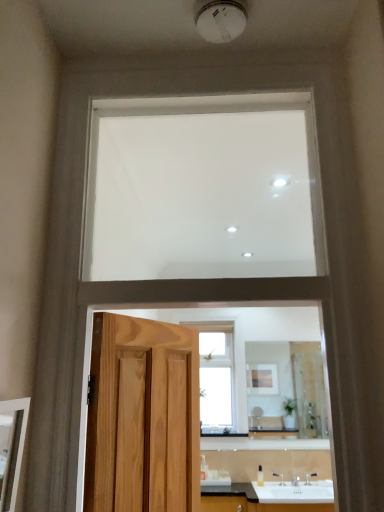
Question: Can you confirm if clear glass window at center, acting as the second window starting from the front, is thinner than white glossy sink at lower center?

Choices:
 (A) no
 (B) yes

Answer: (B)

Question: Is clear glass window at center, the 1th window ordered from the bottom, looking in the opposite direction of white glossy sink at lower center?

Choices:
 (A) yes
 (B) no

Answer: (B)

Question: Is clear glass window at center, the 1th window ordered from the bottom, outside of white glossy sink at lower center?

Choices:
 (A) no
 (B) yes

Answer: (B)

Question: From a real-world perspective, is clear glass window at center, the 1th window ordered from the bottom, positioned over white glossy sink at lower center based on gravity?

Choices:
 (A) no
 (B) yes

Answer: (B)

Question: Is clear glass window at center, acting as the second window starting from the front, with white glossy sink at lower center?

Choices:
 (A) no
 (B) yes

Answer: (A)

Question: Relative to matte wooden mirror at left, the first mirror from the front, is clear glass window at center, the 1th window ordered from the bottom, in front or behind?

Choices:
 (A) front
 (B) behind

Answer: (B)

Question: Looking at the image, does clear glass window at center, acting as the second window starting from the front, seem bigger or smaller compared to matte wooden mirror at left, the 2th mirror in the back-to-front sequence?

Choices:
 (A) small
 (B) big

Answer: (B)

Question: From the image's perspective, relative to matte wooden mirror at left, which is the 1th mirror in left-to-right order, is clear glass window at center, arranged as the 2th window when viewed from the top, above or below?

Choices:
 (A) above
 (B) below

Answer: (B)

Question: Which is correct: clear glass window at center, arranged as the 2th window when viewed from the top, is inside matte wooden mirror at left, which is the first mirror in top-to-bottom order, or outside of it?

Choices:
 (A) inside
 (B) outside

Answer: (B)

Question: Considering the positions of clear glass window at center, the 1th window ordered from the bottom, and clear glass mirror at center, which is counted as the 1th mirror, starting from the bottom, in the image, is clear glass window at center, the 1th window ordered from the bottom, bigger or smaller than clear glass mirror at center, which is counted as the 1th mirror, starting from the bottom,?

Choices:
 (A) big
 (B) small

Answer: (A)

Question: Considering the positions of clear glass window at center, acting as the second window starting from the front, and clear glass mirror at center, the 2th mirror positioned from the top, in the image, is clear glass window at center, acting as the second window starting from the front, wider or thinner than clear glass mirror at center, the 2th mirror positioned from the top,?

Choices:
 (A) wide
 (B) thin

Answer: (A)

Question: Considering the positions of clear glass window at center, positioned as the 1th window in back-to-front order, and clear glass mirror at center, which is counted as the 1th mirror, starting from the bottom, in the image, is clear glass window at center, positioned as the 1th window in back-to-front order, taller or shorter than clear glass mirror at center, which is counted as the 1th mirror, starting from the bottom,?

Choices:
 (A) short
 (B) tall

Answer: (B)

Question: Considering the positions of point (201, 415) and point (266, 373), is point (201, 415) closer or farther from the camera than point (266, 373)?

Choices:
 (A) farther
 (B) closer

Answer: (B)

Question: From the image's perspective, is white glossy sink at lower center positioned above or below white matte window at upper center, which ranks as the second window in back-to-front order?

Choices:
 (A) below
 (B) above

Answer: (A)

Question: Does point (301, 483) appear closer or farther from the camera than point (168, 119)?

Choices:
 (A) farther
 (B) closer

Answer: (A)